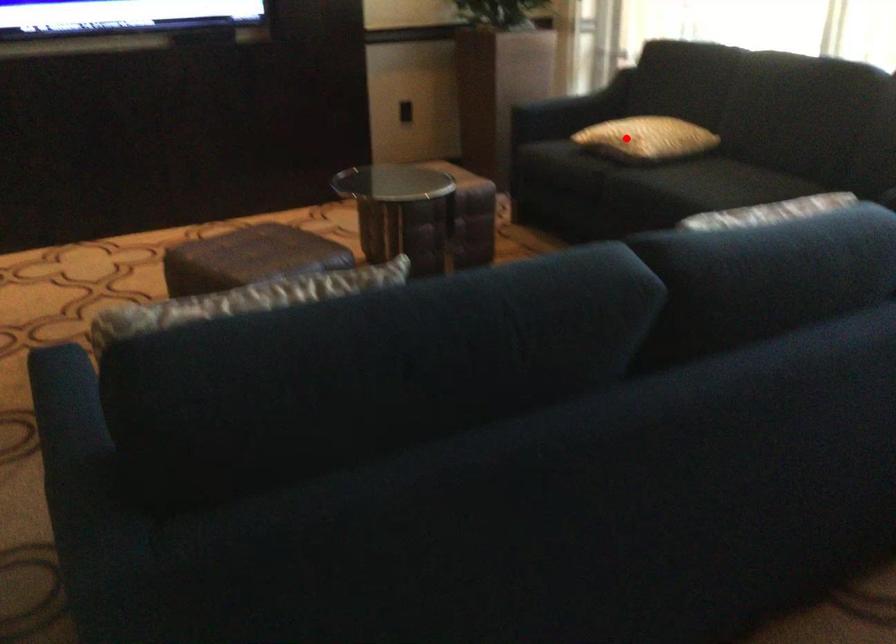
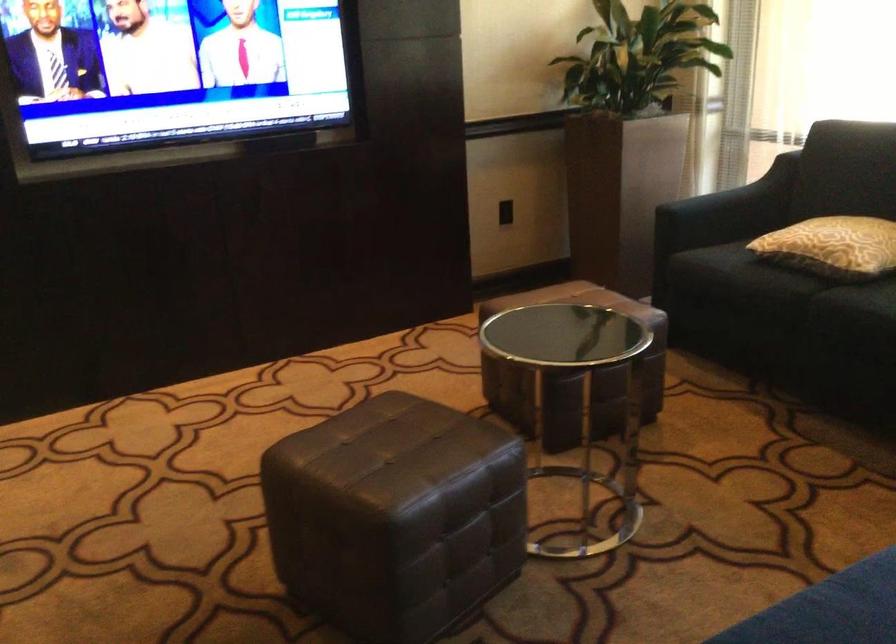
Find the pixel in the second image that matches the highlighted location in the first image.

(832, 245)